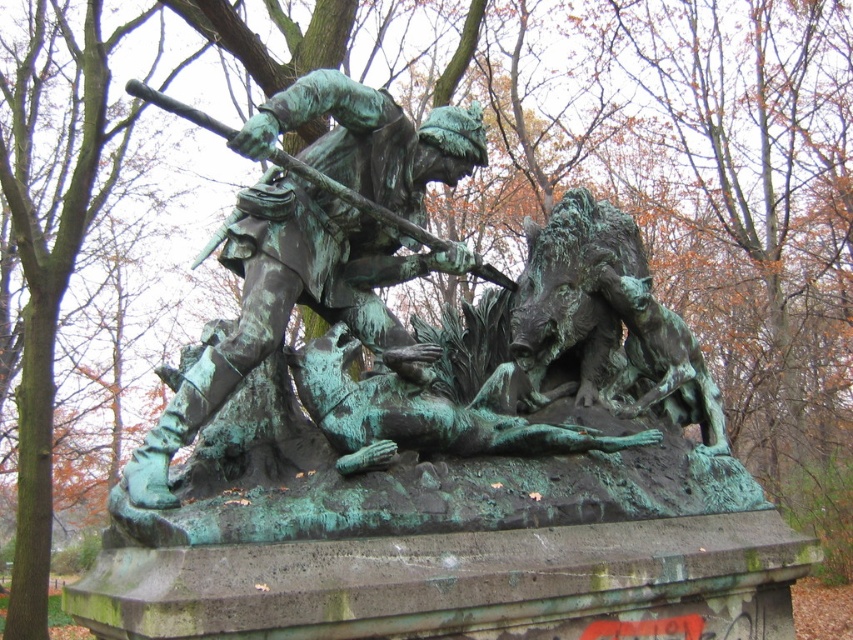
Can you confirm if green patina statue at center is positioned below green patina bronze boar at center?

Incorrect, green patina statue at center is not positioned below green patina bronze boar at center.

Is green patina statue at center closer to camera compared to green patina bronze boar at center?

Yes, it is.

Who is more forward, (x=357, y=90) or (x=590, y=358)?

Point (x=357, y=90)

Image resolution: width=853 pixels, height=640 pixels. Identify the location of green patina statue at center. (317, 241).